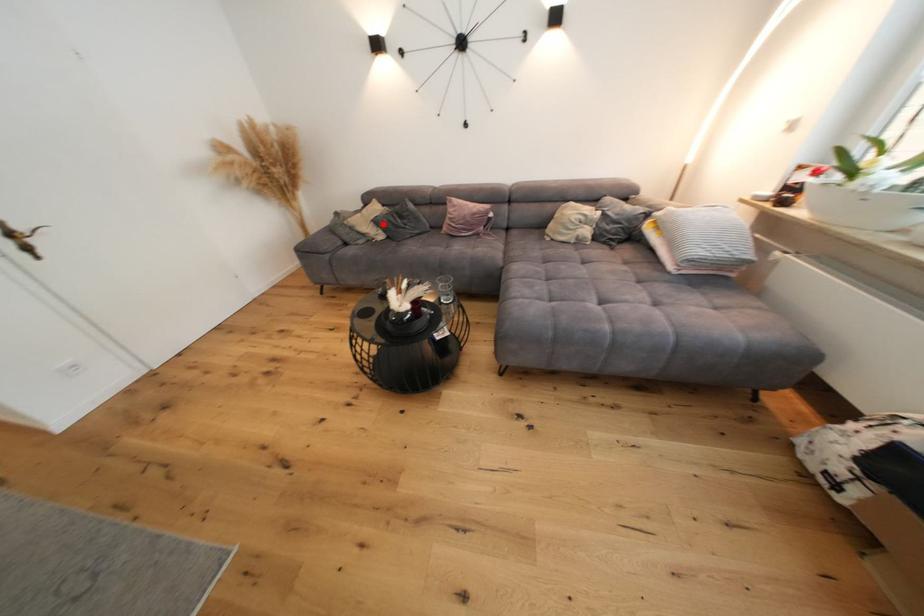
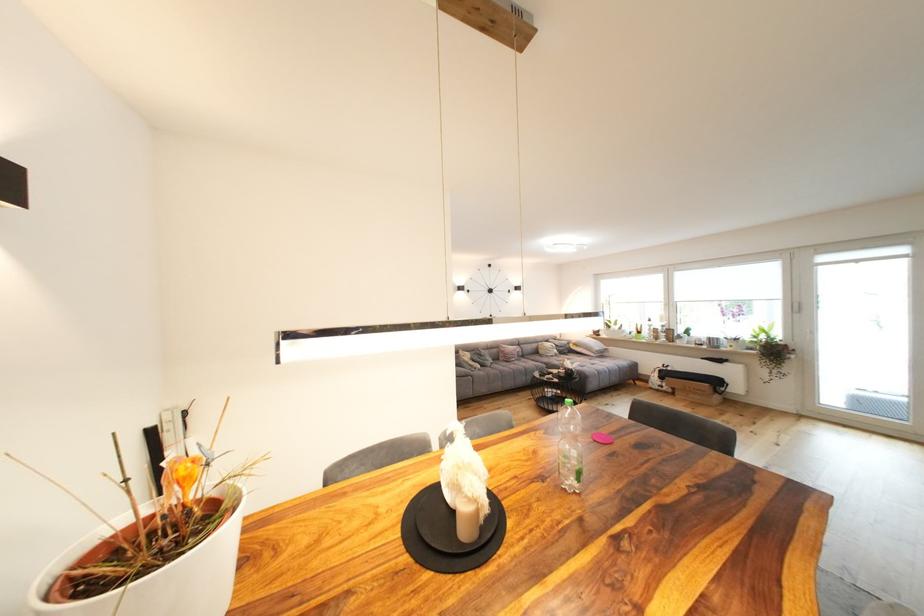
In the second image, find the point that corresponds to the highlighted location in the first image.

(480, 361)